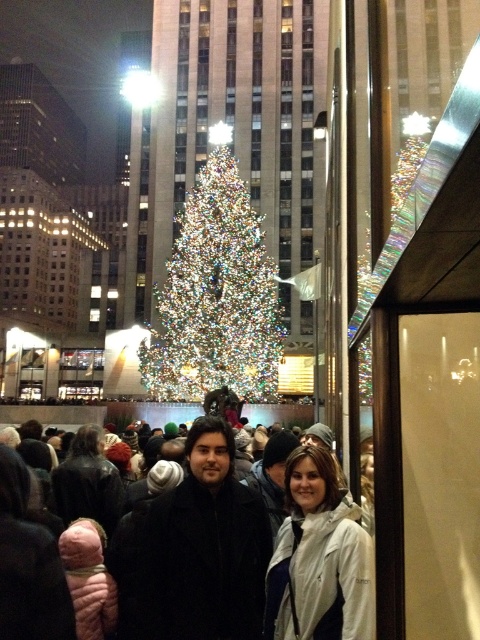
Between illuminated glass christmas tree at center and white matte jacket at center, which one appears on the left side from the viewer's perspective?

illuminated glass christmas tree at center

Which is in front, point (216, 204) or point (302, 536)?

Point (302, 536) is in front.

Where is `illuminated glass christmas tree at center`? illuminated glass christmas tree at center is located at coordinates (216, 294).

Between point (180, 518) and point (173, 291), which one is positioned in front?

Point (180, 518) is in front.

Describe the element at coordinates (315, 556) in the screenshot. I see `black wool coat at center` at that location.

Image resolution: width=480 pixels, height=640 pixels. What do you see at coordinates (315, 556) in the screenshot?
I see `black wool coat at center` at bounding box center [315, 556].

Identify the location of black wool coat at center. (315, 556).

Does black wool coat at center appear on the left side of white matte jacket at center?

Indeed, black wool coat at center is positioned on the left side of white matte jacket at center.

Who is positioned more to the right, black wool coat at center or white matte jacket at center?

Positioned to the right is white matte jacket at center.

Locate an element on the screen. Image resolution: width=480 pixels, height=640 pixels. black wool coat at center is located at coordinates (315, 556).